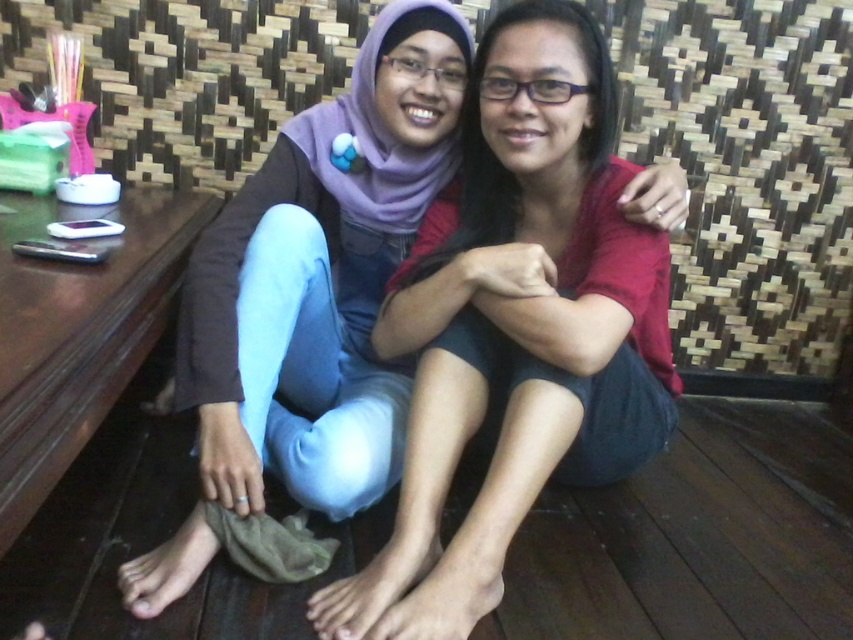
You are standing in the room and want to place a small plant pot on the wooden table to the left of the purple fabric hijab at center. Can you determine if there is enough space on the table for the plant pot?

The purple fabric hijab at center is located at point (517, 328). Since the table is to the left of the purple fabric hijab at center, there should be space available on the table to place the small plant pot.

You are a delivery robot with a package that needs to be placed on the brown wooden table at lower left. You are currently positioned near the purple fabric hijab at center. Can you move the package directly to the table without needing to adjust your path?

The distance between the purple fabric hijab at center and the brown wooden table at lower left is 22.45 inches. Since the robot can move in a straight line, it should be able to place the package directly on the table without needing to adjust its path.